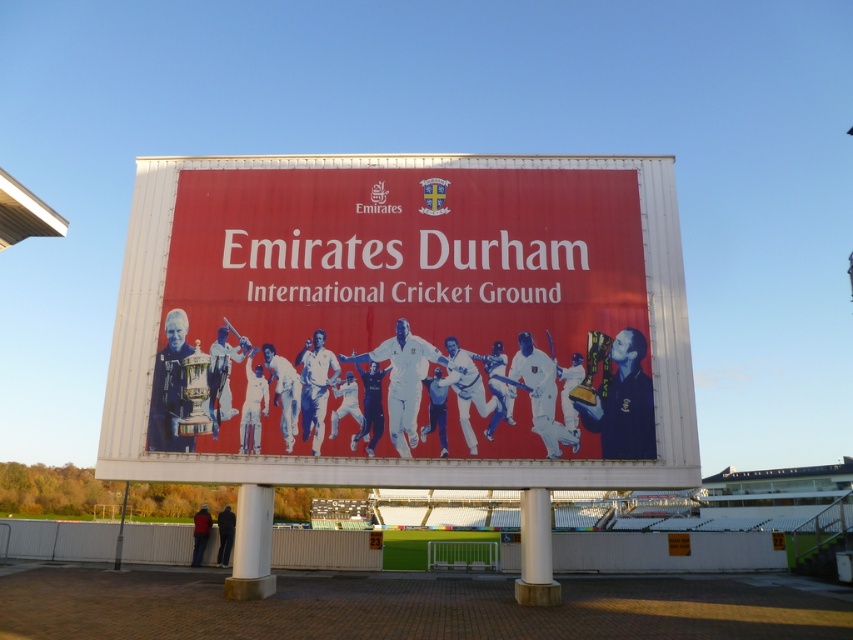
Can you confirm if white concrete pillar at center is positioned to the left of white polished concrete pillar at center?

Indeed, white concrete pillar at center is positioned on the left side of white polished concrete pillar at center.

Is white concrete pillar at center bigger than white polished concrete pillar at center?

Actually, white concrete pillar at center might be smaller than white polished concrete pillar at center.

Does point (244, 596) lie in front of point (519, 579)?

Yes, it is.

The height and width of the screenshot is (640, 853). Identify the location of white concrete pillar at center. (251, 545).

Can you confirm if matte red poster at center is positioned to the right of white concrete pillar at center?

Indeed, matte red poster at center is positioned on the right side of white concrete pillar at center.

Does matte red poster at center have a lesser width compared to white concrete pillar at center?

Incorrect, matte red poster at center's width is not less than white concrete pillar at center's.

Who is more forward, (x=201, y=372) or (x=248, y=534)?

Point (x=248, y=534) is more forward.

The width and height of the screenshot is (853, 640). Identify the location of matte red poster at center. (404, 314).

Does matte red poster at center have a smaller size compared to white polished concrete pillar at center?

Yes, matte red poster at center is smaller than white polished concrete pillar at center.

Is matte red poster at center closer to the viewer compared to white polished concrete pillar at center?

No, matte red poster at center is behind white polished concrete pillar at center.

The width and height of the screenshot is (853, 640). What do you see at coordinates (404, 314) in the screenshot?
I see `matte red poster at center` at bounding box center [404, 314].

The height and width of the screenshot is (640, 853). I want to click on matte red poster at center, so click(x=404, y=314).